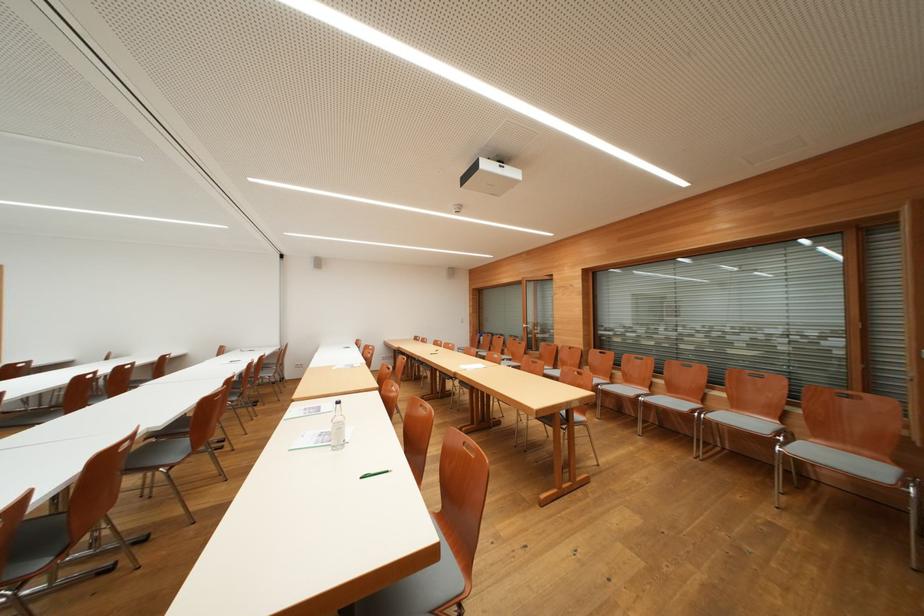
Image resolution: width=924 pixels, height=616 pixels. What do you see at coordinates (540, 336) in the screenshot? I see `the wooden door handle` at bounding box center [540, 336].